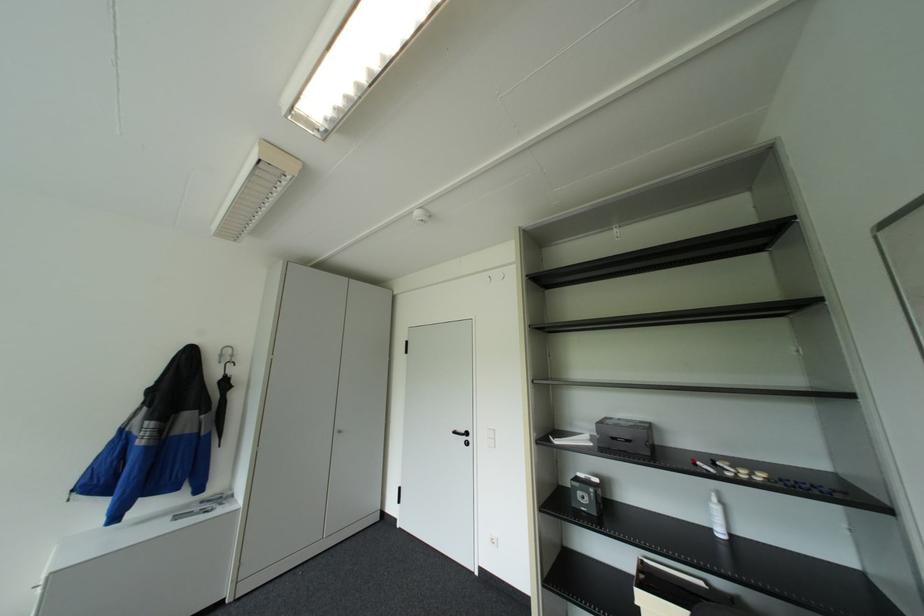
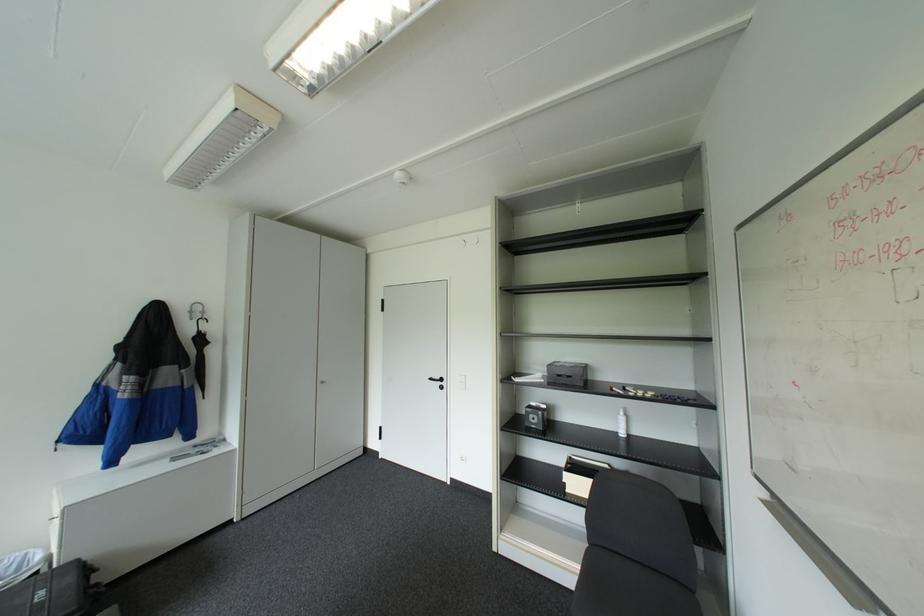
In the second image, find the point that corresponds to point 650,561 in the first image.

(578, 456)